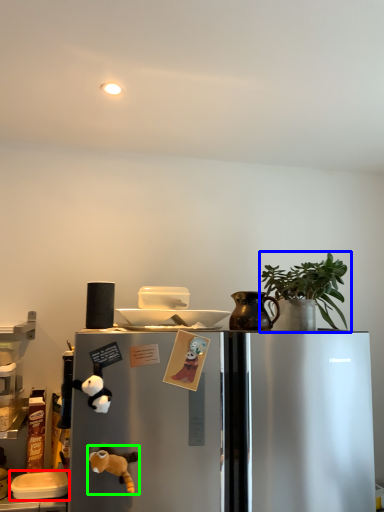
Question: Based on their relative distances, which object is farther from appliance (highlighted by a red box)? Choose from houseplant (highlighted by a blue box) and toy (highlighted by a green box).

Choices:
 (A) houseplant
 (B) toy

Answer: (A)